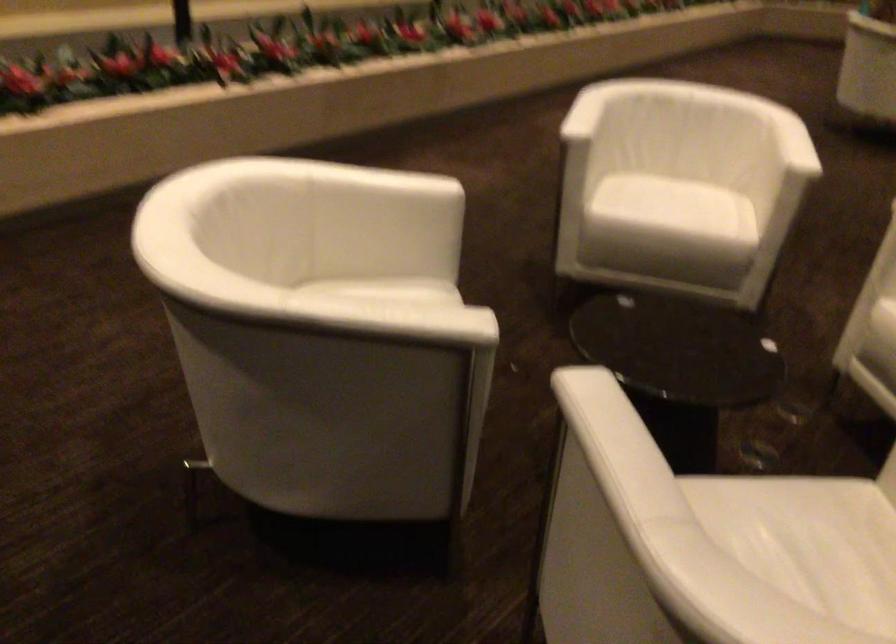
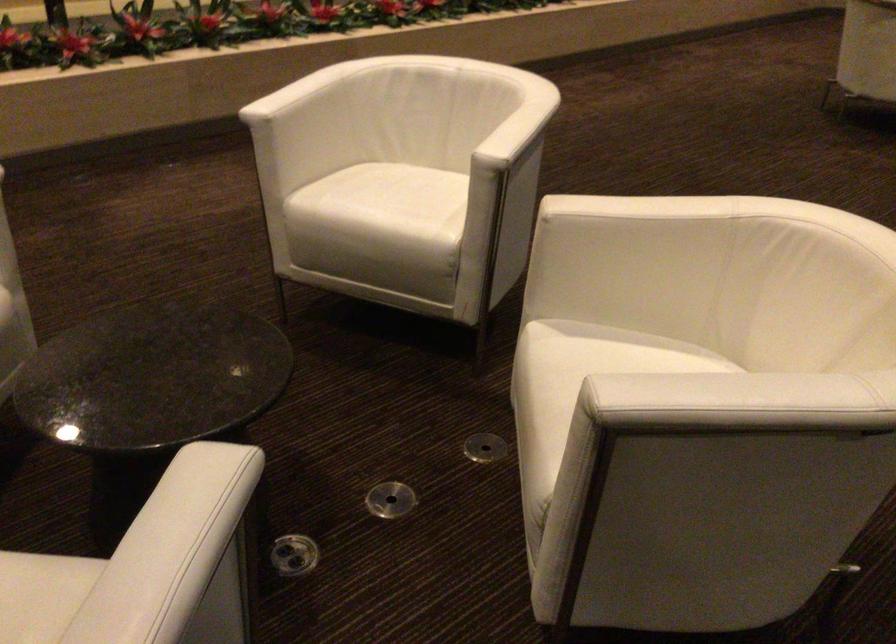
Find the pixel in the second image that matches [794,401] in the first image.

(484, 447)